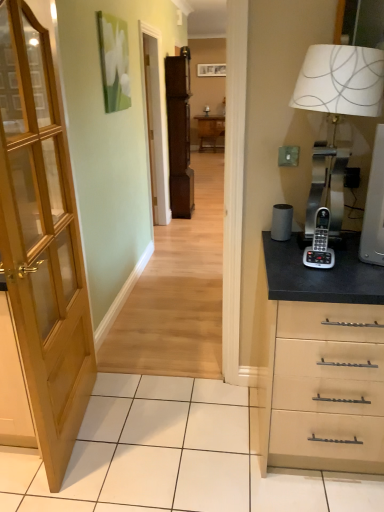
Question: From a real-world perspective, is silver metallic phone at right positioned above or below wooden table at center?

Choices:
 (A) above
 (B) below

Answer: (A)

Question: Considering the positions of silver metallic phone at right and wooden table at center in the image, is silver metallic phone at right taller or shorter than wooden table at center?

Choices:
 (A) tall
 (B) short

Answer: (B)

Question: Based on their relative distances, which object is nearer to the metallic silver table lamp at right?

Choices:
 (A) wooden door at left
 (B) brown wood file cabinet at center
 (C) silver metallic phone at right
 (D) matte wooden screen door at center
 (E) wooden table at center

Answer: (C)

Question: Which object is positioned closest to the wooden table at center?

Choices:
 (A) silver metallic phone at right
 (B) metallic silver table lamp at right
 (C) wooden door at left
 (D) wooden picture frame at upper center
 (E) brown wood file cabinet at center

Answer: (D)